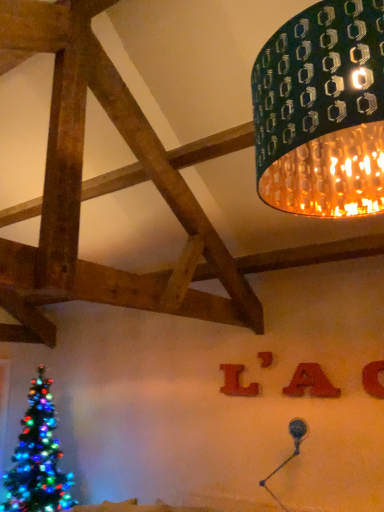
What do you see at coordinates (265, 359) in the screenshot? I see `matte red letter at upper center` at bounding box center [265, 359].

You are a GUI agent. You are given a task and a screenshot of the screen. Output one action in this format:
    pyautogui.click(x=<x>, y=<y>)
    Task: Click on the orange matte letter at upper right, which is the 1th alphabet from right to left
    The height and width of the screenshot is (512, 384).
    Given the screenshot: What is the action you would take?
    pyautogui.click(x=374, y=379)

What do you see at coordinates (311, 383) in the screenshot?
I see `red felt letter a at upper center, the second alphabet viewed from the left` at bounding box center [311, 383].

Image resolution: width=384 pixels, height=512 pixels. Find the location of `matte red letter at center, positioned as the 3th alphabet in right-to-left order`. matte red letter at center, positioned as the 3th alphabet in right-to-left order is located at coordinates (236, 382).

From the image's perspective, is orange matte letter at upper right, placed as the first alphabet when sorted from front to back, positioned above or below green textured lampshade at upper right?

From the image's perspective, orange matte letter at upper right, placed as the first alphabet when sorted from front to back, appears below green textured lampshade at upper right.

Is orange matte letter at upper right, placed as the first alphabet when sorted from front to back, positioned with its back to green textured lampshade at upper right?

No.

Which is less distant, (x=367, y=380) or (x=342, y=33)?

Point (x=367, y=380) appears to be farther away from the viewer than point (x=342, y=33).

From a real-world perspective, is orange matte letter at upper right, placed as the first alphabet when sorted from front to back, positioned under green textured lampshade at upper right based on gravity?

Correct, in the physical world, orange matte letter at upper right, placed as the first alphabet when sorted from front to back, is lower than green textured lampshade at upper right.

Is orange matte letter at upper right, the third alphabet from the left, in front of or behind matte red letter at upper center in the image?

Visually, orange matte letter at upper right, the third alphabet from the left, is located in front of matte red letter at upper center.

Is orange matte letter at upper right, which is the 1th alphabet from right to left, not close to matte red letter at upper center?

No, orange matte letter at upper right, which is the 1th alphabet from right to left, is in close proximity to matte red letter at upper center.

From a real-world perspective, is orange matte letter at upper right, placed as the first alphabet when sorted from front to back, physically above matte red letter at upper center?

Incorrect, from a real-world perspective, orange matte letter at upper right, placed as the first alphabet when sorted from front to back, is lower than matte red letter at upper center.

Which of these two, matte red letter at center, which appears as the 3th alphabet when viewed from the front, or metallic silver table lamp at lower right, is wider?

metallic silver table lamp at lower right.

Which is in front, point (229, 365) or point (294, 422)?

Positioned in front is point (294, 422).

Does matte red letter at center, positioned as the 3th alphabet in right-to-left order, come in front of metallic silver table lamp at lower right?

No, it is not.

From the image's perspective, which one is positioned higher, matte red letter at upper center or red felt letter a at upper center, the second alphabet from the right?

From the image's view, matte red letter at upper center is above.

Is matte red letter at upper center next to red felt letter a at upper center, the 2th alphabet in the front-to-back sequence, and touching it?

No, matte red letter at upper center is not in contact with red felt letter a at upper center, the 2th alphabet in the front-to-back sequence.

Is matte red letter at upper center in front of or behind red felt letter a at upper center, the second alphabet from the right, in the image?

matte red letter at upper center is positioned farther from the viewer than red felt letter a at upper center, the second alphabet from the right.

Are metallic silver table lamp at lower right and matte red letter at center, positioned as the 3th alphabet in right-to-left order, beside each other?

metallic silver table lamp at lower right is not next to matte red letter at center, positioned as the 3th alphabet in right-to-left order, and they're not touching.

Is metallic silver table lamp at lower right looking in the opposite direction of matte red letter at center, positioned as the 3th alphabet in right-to-left order?

metallic silver table lamp at lower right is not turned away from matte red letter at center, positioned as the 3th alphabet in right-to-left order.

Measure the distance from metallic silver table lamp at lower right to matte red letter at center, which is the 1th alphabet from left to right.

A distance of 27.23 inches exists between metallic silver table lamp at lower right and matte red letter at center, which is the 1th alphabet from left to right.

What's the angular difference between metallic silver table lamp at lower right and matte red letter at center, which is the 1th alphabet from left to right,'s facing directions?

metallic silver table lamp at lower right and matte red letter at center, which is the 1th alphabet from left to right, are facing 0.00277 degrees away from each other.

Which of these two, matte red letter at center, acting as the first alphabet starting from the back, or red felt letter a at upper center, the 2th alphabet in the front-to-back sequence, stands shorter?

With less height is red felt letter a at upper center, the 2th alphabet in the front-to-back sequence.

Considering the sizes of matte red letter at center, positioned as the 3th alphabet in right-to-left order, and red felt letter a at upper center, the 2th alphabet from the back, in the image, is matte red letter at center, positioned as the 3th alphabet in right-to-left order, bigger or smaller than red felt letter a at upper center, the 2th alphabet from the back,?

matte red letter at center, positioned as the 3th alphabet in right-to-left order, is smaller than red felt letter a at upper center, the 2th alphabet from the back.

From the image's perspective, does matte red letter at center, acting as the first alphabet starting from the back, appear lower than red felt letter a at upper center, the second alphabet from the right?

Yes, from the image's perspective, matte red letter at center, acting as the first alphabet starting from the back, is below red felt letter a at upper center, the second alphabet from the right.

Would you say matte red letter at center, which is the 1th alphabet from left to right, is outside red felt letter a at upper center, the second alphabet from the right?

matte red letter at center, which is the 1th alphabet from left to right, lies outside red felt letter a at upper center, the second alphabet from the right,'s area.

In the scene shown: Between red felt letter a at upper center, the 2th alphabet in the front-to-back sequence, and matte red letter at center, positioned as the 3th alphabet in right-to-left order, which one has less height?

red felt letter a at upper center, the 2th alphabet in the front-to-back sequence, is shorter.

Is red felt letter a at upper center, the 2th alphabet from the back, facing towards matte red letter at center, positioned as the 3th alphabet in right-to-left order?

No.

Is red felt letter a at upper center, the second alphabet viewed from the left, thinner than matte red letter at center, positioned as the 3th alphabet in right-to-left order?

In fact, red felt letter a at upper center, the second alphabet viewed from the left, might be wider than matte red letter at center, positioned as the 3th alphabet in right-to-left order.

Which point is more distant from viewer, [306,383] or [229,392]?

The point [229,392] is behind.

Identify the location of lamp that appears on the left of orange matte letter at upper right, placed as the first alphabet when sorted from front to back. Image resolution: width=384 pixels, height=512 pixels. (322, 112).

Locate an element on the screen. letter above the orange matte letter at upper right, arranged as the 3th alphabet when viewed from the back (from the image's perspective) is located at coordinates (265, 359).

Which object lies nearer to the anchor point red felt letter a at upper center, the 2th alphabet in the front-to-back sequence, green textured lampshade at upper right or orange matte letter at upper right, which is the 1th alphabet from right to left?

orange matte letter at upper right, which is the 1th alphabet from right to left, is positioned closer to the anchor red felt letter a at upper center, the 2th alphabet in the front-to-back sequence.

Estimate the real-world distances between objects in this image. Which object is closer to matte red letter at upper center, orange matte letter at upper right, the third alphabet from the left, or matte red letter at center, acting as the first alphabet starting from the back?

matte red letter at center, acting as the first alphabet starting from the back, is positioned closer to the anchor matte red letter at upper center.

When comparing their distances from matte red letter at upper center, does red felt letter a at upper center, the second alphabet from the right, or orange matte letter at upper right, which is the 1th alphabet from right to left, seem closer?

Based on the image, red felt letter a at upper center, the second alphabet from the right, appears to be nearer to matte red letter at upper center.

When comparing their distances from matte red letter at center, acting as the first alphabet starting from the back, does matte red letter at upper center or metallic silver table lamp at lower right seem closer?

matte red letter at upper center.

Which object lies nearer to the anchor point red felt letter a at upper center, the second alphabet viewed from the left, metallic silver table lamp at lower right or matte red letter at center, acting as the first alphabet starting from the back?

matte red letter at center, acting as the first alphabet starting from the back, is closer to red felt letter a at upper center, the second alphabet viewed from the left.

Consider the image. Looking at the image, which one is located further to red felt letter a at upper center, the 2th alphabet in the front-to-back sequence, green textured lampshade at upper right or matte red letter at center, which appears as the 3th alphabet when viewed from the front?

green textured lampshade at upper right lies further to red felt letter a at upper center, the 2th alphabet in the front-to-back sequence, than the other object.

Looking at the image, which one is located further to metallic silver table lamp at lower right, matte red letter at center, which appears as the 3th alphabet when viewed from the front, or green textured lampshade at upper right?

green textured lampshade at upper right is further to metallic silver table lamp at lower right.

Considering their positions, is orange matte letter at upper right, which is the 1th alphabet from right to left, positioned further to matte red letter at center, positioned as the 3th alphabet in right-to-left order, than matte red letter at upper center?

orange matte letter at upper right, which is the 1th alphabet from right to left, is positioned further to the anchor matte red letter at center, positioned as the 3th alphabet in right-to-left order.

Locate an element on the screen. alphabet between green textured lampshade at upper right and red felt letter a at upper center, the 2th alphabet from the back, from front to back is located at coordinates (374, 379).

The width and height of the screenshot is (384, 512). Find the location of `alphabet between metallic silver table lamp at lower right and orange matte letter at upper right, arranged as the 3th alphabet when viewed from the back, in the horizontal direction`. alphabet between metallic silver table lamp at lower right and orange matte letter at upper right, arranged as the 3th alphabet when viewed from the back, in the horizontal direction is located at coordinates (311, 383).

At what (x,y) coordinates should I click in order to perform the action: click on letter between matte red letter at center, positioned as the 3th alphabet in right-to-left order, and orange matte letter at upper right, the third alphabet from the left. Please return your answer as a coordinate pair (x, y). The image size is (384, 512). Looking at the image, I should click on (265, 359).

Identify the location of alphabet between matte red letter at center, positioned as the 3th alphabet in right-to-left order, and orange matte letter at upper right, the third alphabet from the left, from left to right. (311, 383).